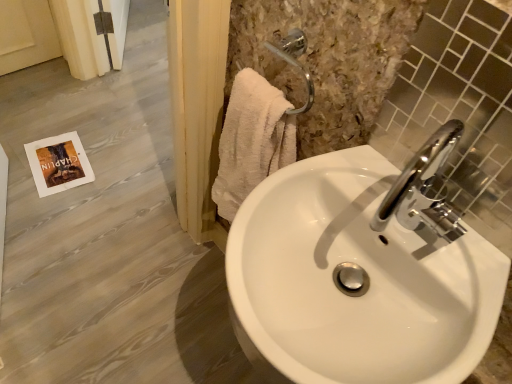
Question: Which is correct: chrome metallic faucet at upper right is inside white glossy sink at center, or outside of it?

Choices:
 (A) outside
 (B) inside

Answer: (A)

Question: Does point (429, 155) appear closer or farther from the camera than point (461, 331)?

Choices:
 (A) farther
 (B) closer

Answer: (A)

Question: Which is farther from the white glossy sink at center?

Choices:
 (A) chrome metallic faucet at upper right
 (B) chrome metallic faucet at upper right
 (C) white fluffy towel at upper right

Answer: (C)

Question: Based on their relative distances, which object is farther from the white fluffy towel at upper right?

Choices:
 (A) chrome metallic faucet at upper right
 (B) white glossy sink at center
 (C) chrome metallic faucet at upper right

Answer: (A)